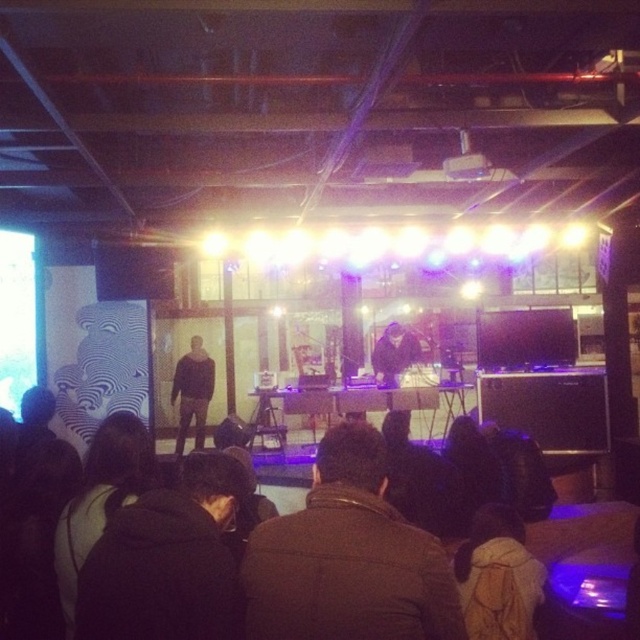
Question: Which of the following is the farthest from the observer?

Choices:
 (A) dark fabric jacket at lower left
 (B) dark fabric jacket at center
 (C) brown woolen jacket at center
 (D) black fuzzy jacket at lower center

Answer: (B)

Question: Considering the real-world distances, which object is farthest from the dark brown sweater at center?

Choices:
 (A) brown woolen jacket at center
 (B) dark fabric jacket at lower left
 (C) black fuzzy jacket at lower center
 (D) dark fabric jacket at center

Answer: (A)

Question: Among these objects, which one is nearest to the camera?

Choices:
 (A) brown backpack at lower right
 (B) dark brown sweater at center

Answer: (A)

Question: Observing the image, what is the correct spatial positioning of dark brown sweater at center in reference to dark fabric jacket at center?

Choices:
 (A) right
 (B) left

Answer: (B)

Question: Can you confirm if dark fabric jacket at lower left is positioned to the left of brown backpack at lower right?

Choices:
 (A) no
 (B) yes

Answer: (B)

Question: Does dark fabric jacket at lower left appear on the left side of dark brown sweater at center?

Choices:
 (A) no
 (B) yes

Answer: (A)